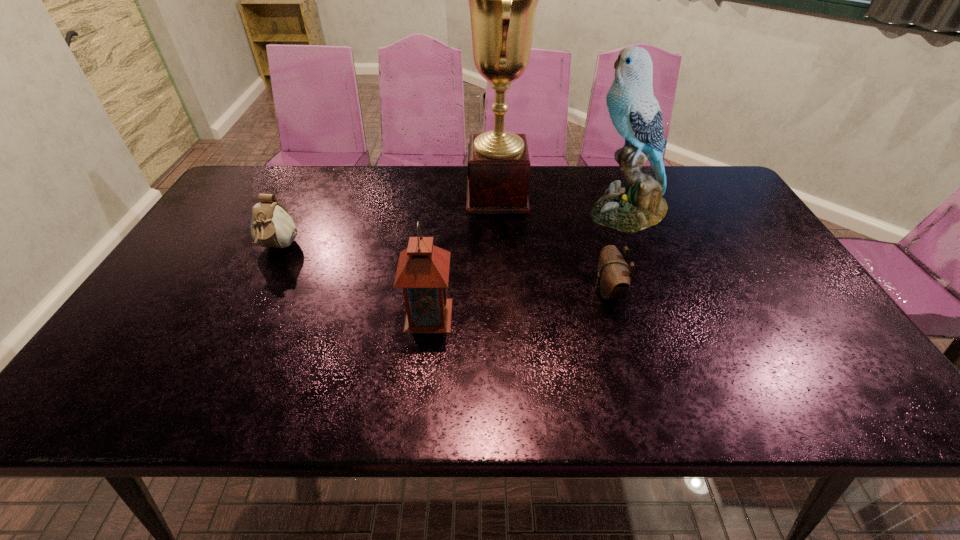
Locate an element on the screen. This screenshot has height=540, width=960. free spot located 0.250m on the plaque of the trophy cup is located at coordinates (389, 195).

Identify the location of vacant space located 0.200m on the plaque of the trophy cup. (404, 195).

Locate an element on the screen. The height and width of the screenshot is (540, 960). free space located on the face of the parakeet is located at coordinates (505, 211).

Identify the location of free point located on the face of the parakeet. This screenshot has height=540, width=960. (512, 211).

This screenshot has height=540, width=960. What are the coordinates of `free space located on the face of the parakeet` in the screenshot? It's located at (463, 211).

Locate an element on the screen. This screenshot has height=540, width=960. free space located 0.360m on the right of the lantern is located at coordinates coord(604,315).

Locate an element on the screen. The height and width of the screenshot is (540, 960). vacant point located 0.180m on the front-facing side of the left pouch is located at coordinates point(244,315).

The width and height of the screenshot is (960, 540). I want to click on free space located with the flap open on the shorter pouch, so point(491,292).

Find the location of `free point located with the flap open on the shorter pouch`. free point located with the flap open on the shorter pouch is located at coordinates pyautogui.click(x=546, y=292).

You are a GUI agent. You are given a task and a screenshot of the screen. Output one action in this format:
    pyautogui.click(x=<x>, y=<y>)
    Task: Click on the free space located 0.050m with the flap open on the shorter pouch
    
    Given the screenshot: What is the action you would take?
    pyautogui.click(x=574, y=292)